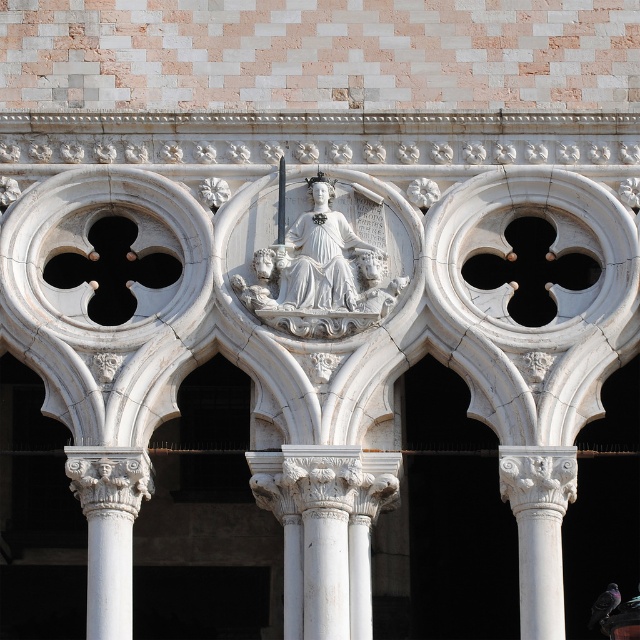
You are an architect designing a new plaza and need to place a 10 meter long bench between the white marble column at center and the white marble column at lower left. Based on the image, will the bench fit between them?

The distance between the white marble column at center and the white marble column at lower left is 9.12 meters, so the 10 meter long bench will not fit between them as it is longer than the available space.

You are an architect analyzing the facade. You see a point marked at coordinates [323,268]. What does this point indicate?

The point at coordinates [323,268] marks the location of the white stone statue at center.

You are an art conservator examining the architectural facade. You need to access both the white stone statue at center and the white marble column at right for restoration. Based on their positions, which object is farther from your current viewpoint?

The white marble column at right is farther from your current viewpoint because it is positioned behind the white stone statue at center.